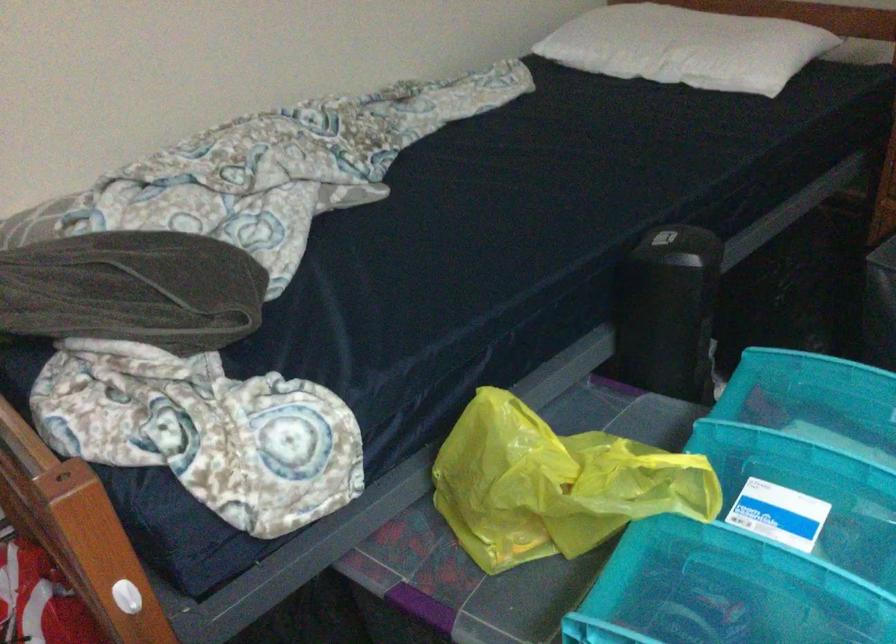
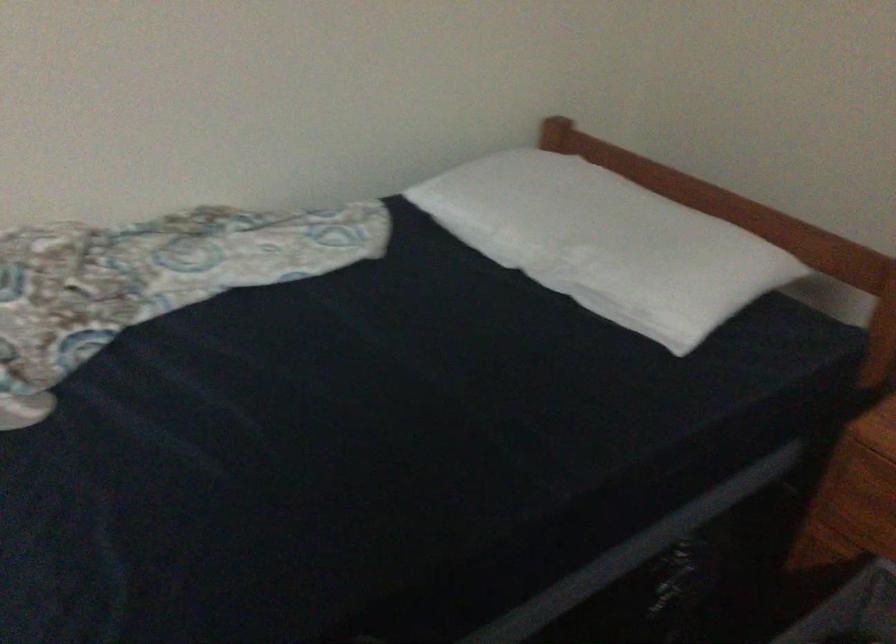
In a continuous first-person perspective shot, in which direction is the camera moving?

The movement direction of the cameraman is right, forward.